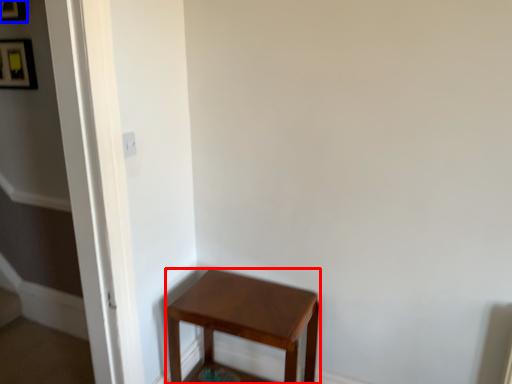
Question: Which object appears farthest to the camera in this image, stool (highlighted by a red box) or picture frame (highlighted by a blue box)?

Choices:
 (A) stool
 (B) picture frame

Answer: (B)